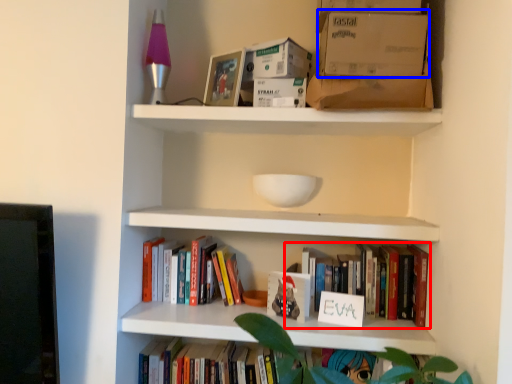
Question: Which of the following is the closest to the observer, book (highlighted by a red box) or cardboard box (highlighted by a blue box)?

Choices:
 (A) book
 (B) cardboard box

Answer: (B)